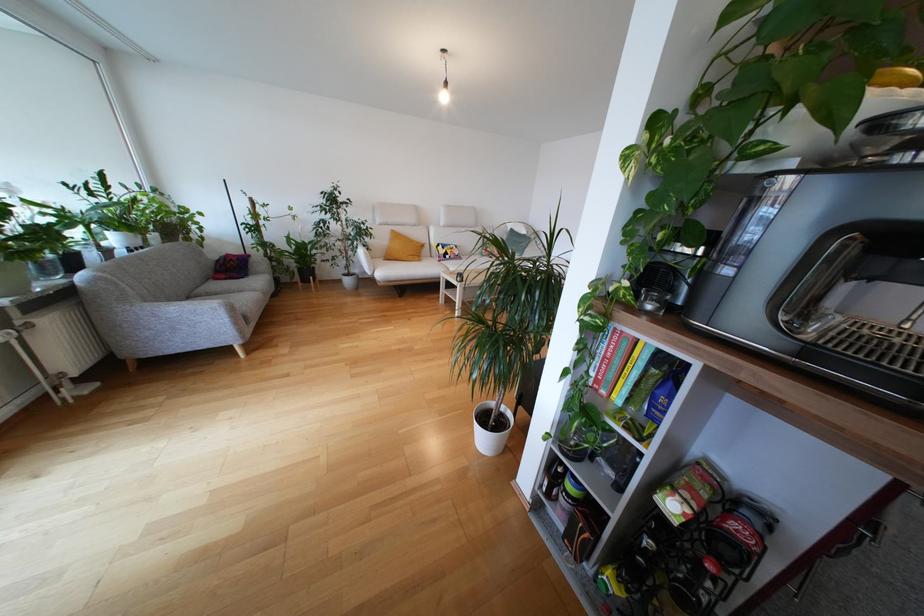
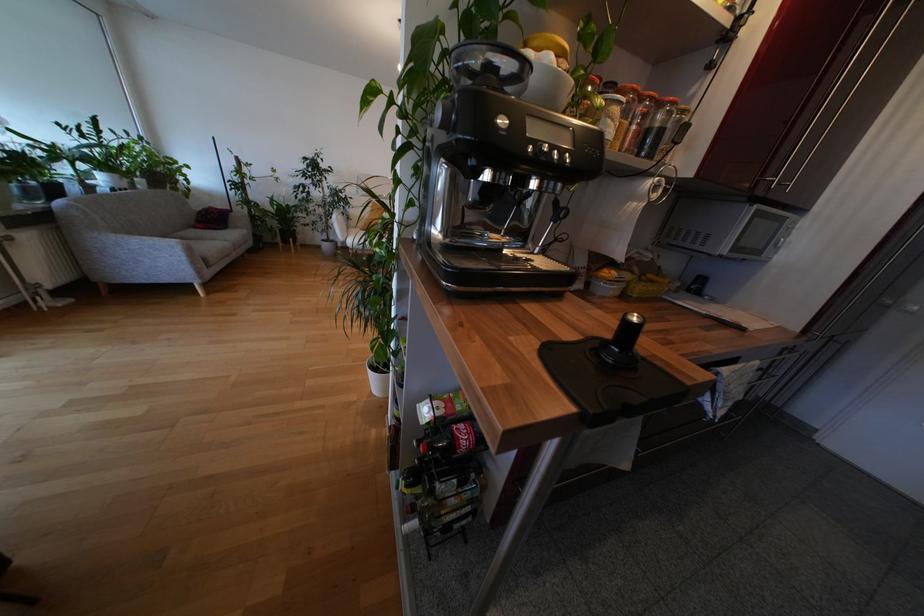
Question: The camera is either moving clockwise (left) or counter-clockwise (right) around the object. The first image is from the beginning of the video and the second image is from the end. Is the camera moving left or right when shooting the video?

Choices:
 (A) Left
 (B) Right

Answer: (B)